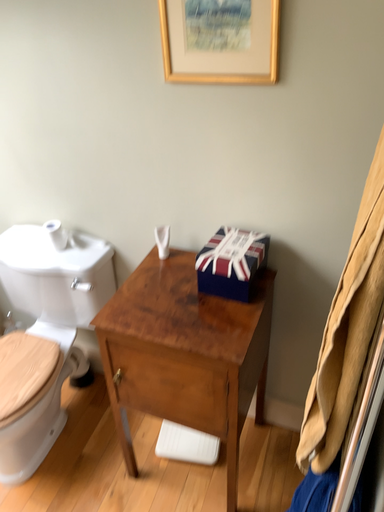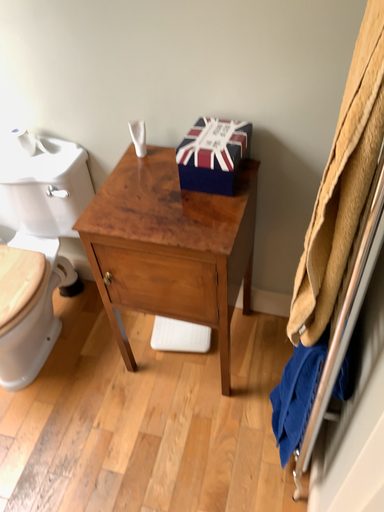
Question: How did the camera likely rotate when shooting the video?

Choices:
 (A) rotated downward
 (B) rotated upward

Answer: (A)